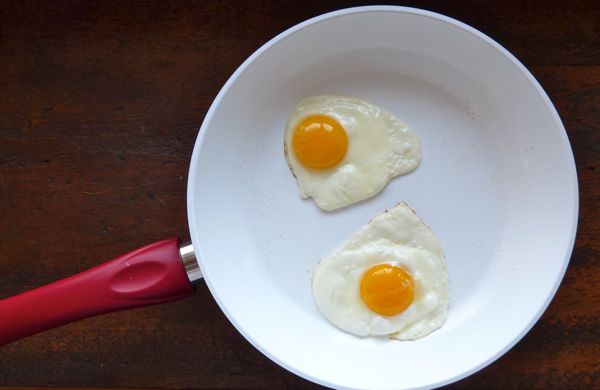
Locate an element on the screen. The width and height of the screenshot is (600, 390). empty space left of eggs on table is located at coordinates (95, 171).